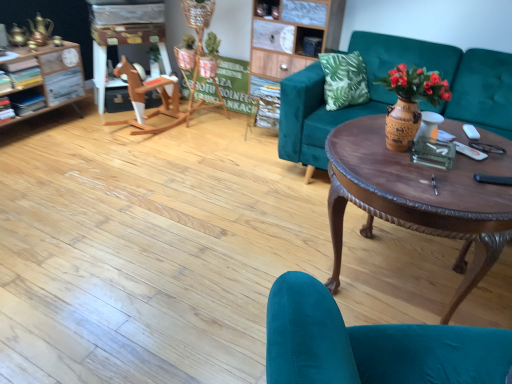
Question: Based on their positions, is green cardboard sign at center located to the left or right of teal velvet chair at lower right?

Choices:
 (A) right
 (B) left

Answer: (B)

Question: Does point (237, 104) appear closer or farther from the camera than point (296, 362)?

Choices:
 (A) farther
 (B) closer

Answer: (A)

Question: Which is farther from the teal velvet chair at lower right?

Choices:
 (A) wooden rocking horse at left
 (B) teal velvet couch at center
 (C) brown polished wood coffee table at center
 (D) wooden vase with flowers at center
 (E) green cardboard sign at center

Answer: (E)

Question: Estimate the real-world distances between objects in this image. Which object is closer to the green cardboard sign at center?

Choices:
 (A) teal velvet couch at center
 (B) teal velvet chair at lower right
 (C) wooden rocking horse at left
 (D) brown polished wood coffee table at center
 (E) wooden vase with flowers at center

Answer: (C)